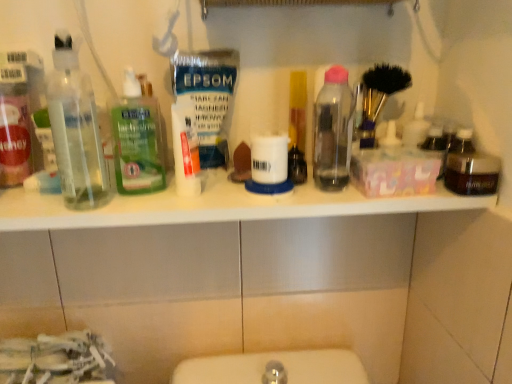
Image resolution: width=512 pixels, height=384 pixels. Identify the location of vacant point above white plastic shelf at upper center (from a real-world perspective). (199, 190).